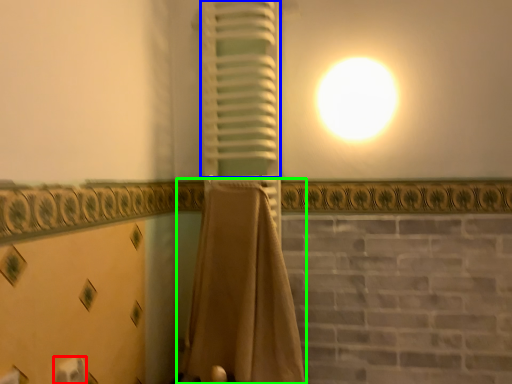
Question: Which object is positioned closest to toilet paper (highlighted by a red box)? Select from curtain (highlighted by a blue box) and curtain (highlighted by a green box).

Choices:
 (A) curtain
 (B) curtain

Answer: (B)